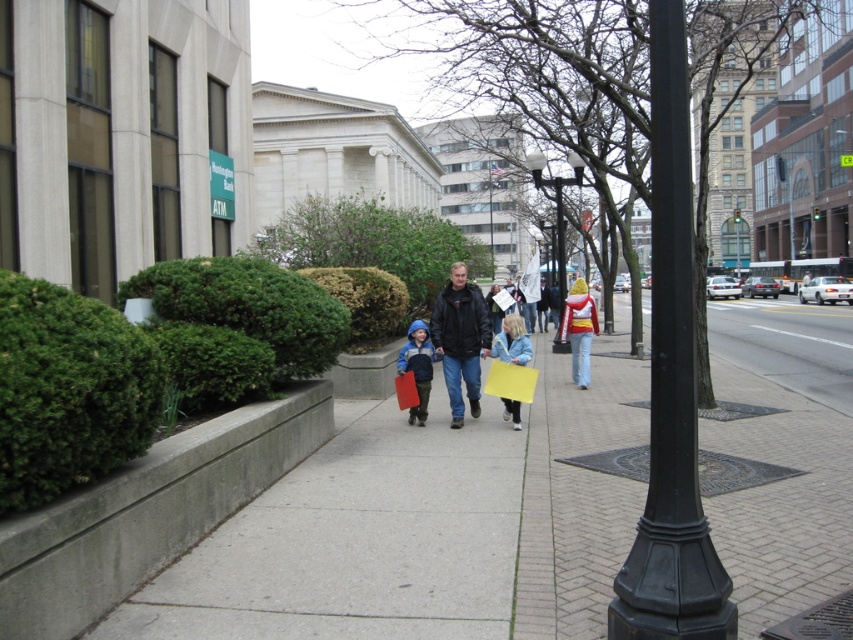
Question: Estimate the real-world distances between objects in this image. Which object is farther from the black leather jacket at center?

Choices:
 (A) black metal pole at center
 (B) yellow paper at center

Answer: (B)

Question: Can you confirm if black metal pole at center is bigger than matte blue jacket at center?

Choices:
 (A) yes
 (B) no

Answer: (A)

Question: Is matte black jacket at center bigger than yellow knit hat at center?

Choices:
 (A) yes
 (B) no

Answer: (A)

Question: Does concrete sidewalk at center have a lesser width compared to matte blue jacket at center?

Choices:
 (A) yes
 (B) no

Answer: (B)

Question: Which of the following is the closest to the observer?

Choices:
 (A) matte black jacket at center
 (B) black metal pole at center
 (C) light blue denim jacket at center

Answer: (B)

Question: Which object is closer to the camera taking this photo?

Choices:
 (A) black leather jacket at center
 (B) light blue denim jacket at center
 (C) black metal pole at right
 (D) black metal streetlight at center

Answer: (A)